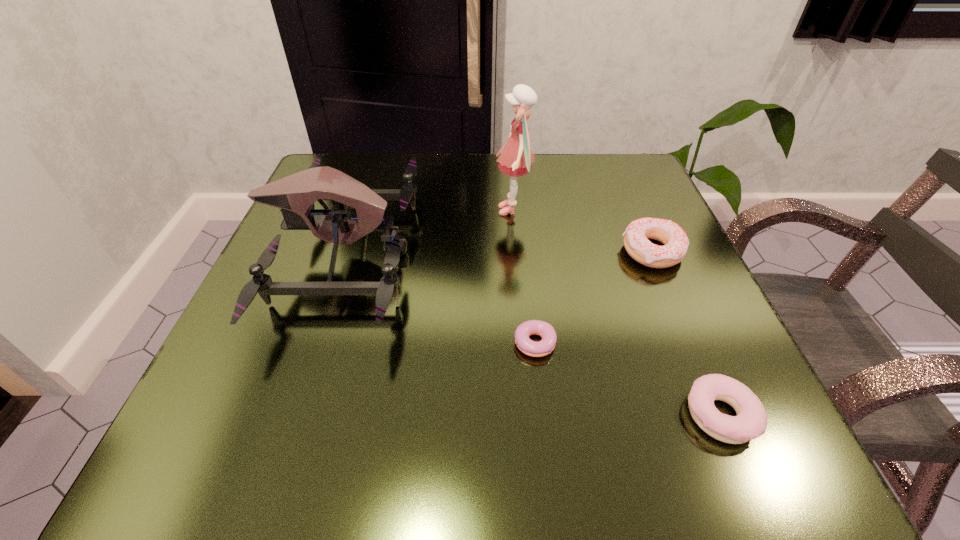
Locate an element on the screen. The image size is (960, 540). free space between the doll and the second nearest doughnut is located at coordinates (524, 279).

Locate an element on the screen. Image resolution: width=960 pixels, height=540 pixels. empty location between the second shortest object and the doll is located at coordinates (616, 312).

I want to click on free space between the leftmost doughnut and the farthest doughnut, so click(x=593, y=299).

Where is `vacant area that lies between the second farthest doughnut and the leftmost object`? Image resolution: width=960 pixels, height=540 pixels. vacant area that lies between the second farthest doughnut and the leftmost object is located at coordinates (439, 300).

Image resolution: width=960 pixels, height=540 pixels. Find the location of `free space between the second shortest doughnut and the tallest doughnut`. free space between the second shortest doughnut and the tallest doughnut is located at coordinates click(x=686, y=333).

You are a GUI agent. You are given a task and a screenshot of the screen. Output one action in this format:
    pyautogui.click(x=<x>, y=<y>)
    Task: Click on the free area in between the nearest object and the second nearest doughnut
    
    Given the screenshot: What is the action you would take?
    pyautogui.click(x=628, y=381)

What are the coordinates of `empty space that is in between the tallest doughnut and the leftmost doughnut` in the screenshot? It's located at (593, 299).

In order to click on the second closest object to the shortest object in this screenshot , I will do `click(295, 194)`.

Locate an element on the screen. the closest object to the shortest object is located at coordinates (751, 421).

Select which doughnut appears as the second closest to the shortest doughnut. Please provide its 2D coordinates. Your answer should be formatted as a tuple, i.e. [(x, y)], where the tuple contains the x and y coordinates of a point satisfying the conditions above.

[(637, 233)]